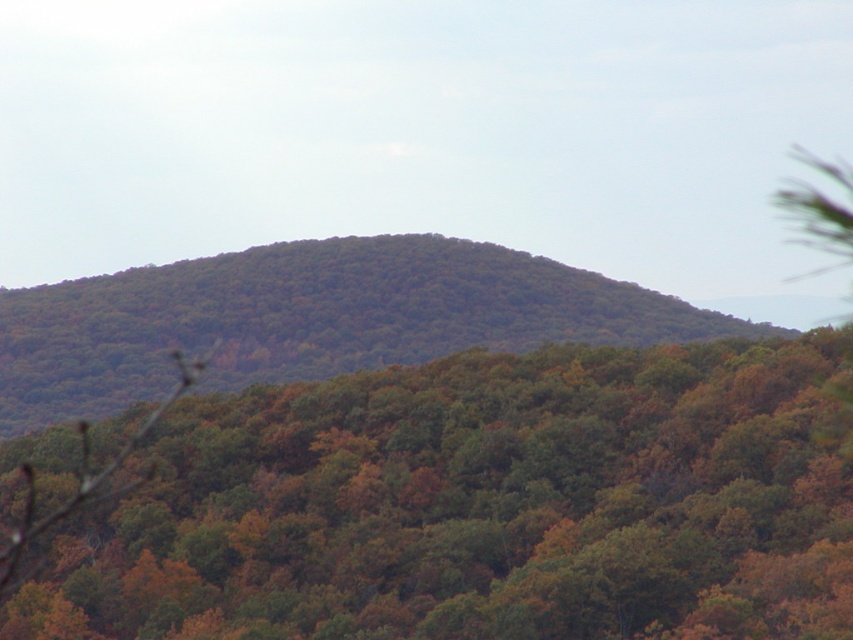
Is green matte forest at center smaller than green leafy forest at center?

Actually, green matte forest at center might be larger than green leafy forest at center.

Is point (469, 422) behind point (479, 275)?

That is False.

Locate an element on the screen. green matte forest at center is located at coordinates (482, 506).